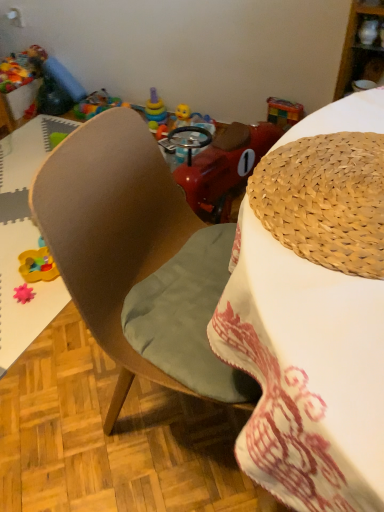
This screenshot has height=512, width=384. In order to click on vacant space behind pink rubber star at lower left, the 3th toy in the top-to-bottom sequence in this screenshot , I will do `click(28, 275)`.